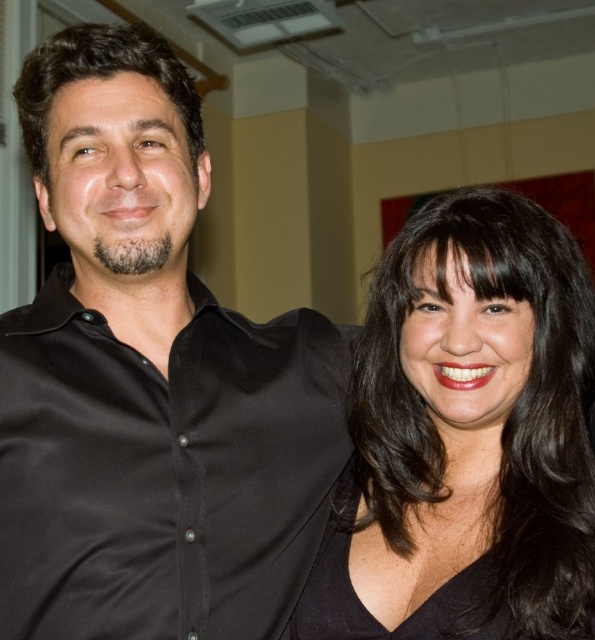
Question: Which point appears farthest from the camera in this image?

Choices:
 (A) (574, 289)
 (B) (43, 563)

Answer: (A)

Question: Which of the following is the farthest from the observer?

Choices:
 (A) (384, 316)
 (B) (177, 163)

Answer: (A)

Question: Does matte black shirt at center have a greater width compared to black matte hair at right?

Choices:
 (A) yes
 (B) no

Answer: (A)

Question: Is matte black shirt at center wider than black matte hair at right?

Choices:
 (A) yes
 (B) no

Answer: (A)

Question: Is matte black shirt at center smaller than black matte hair at right?

Choices:
 (A) yes
 (B) no

Answer: (B)

Question: Which point appears farthest from the camera in this image?

Choices:
 (A) (167, 432)
 (B) (480, 285)

Answer: (A)